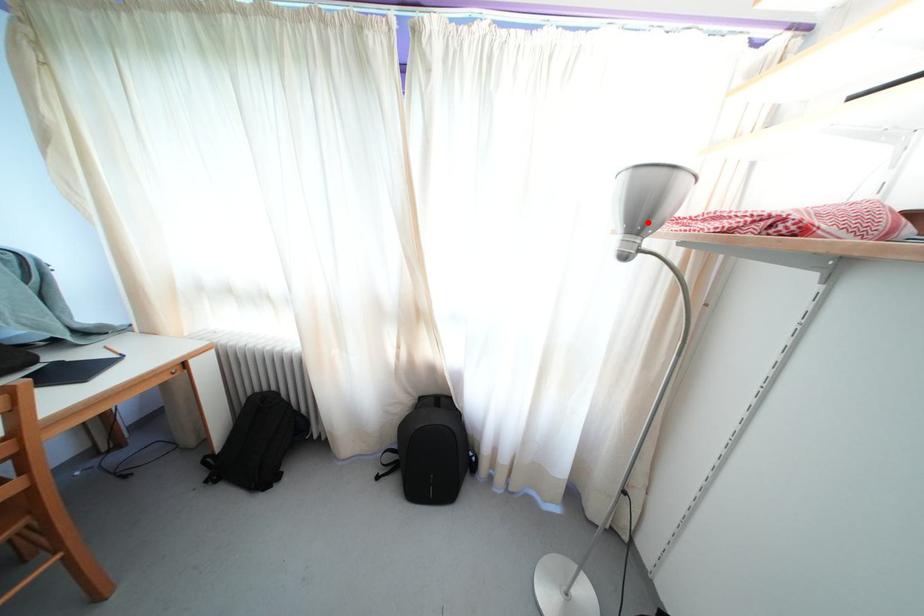
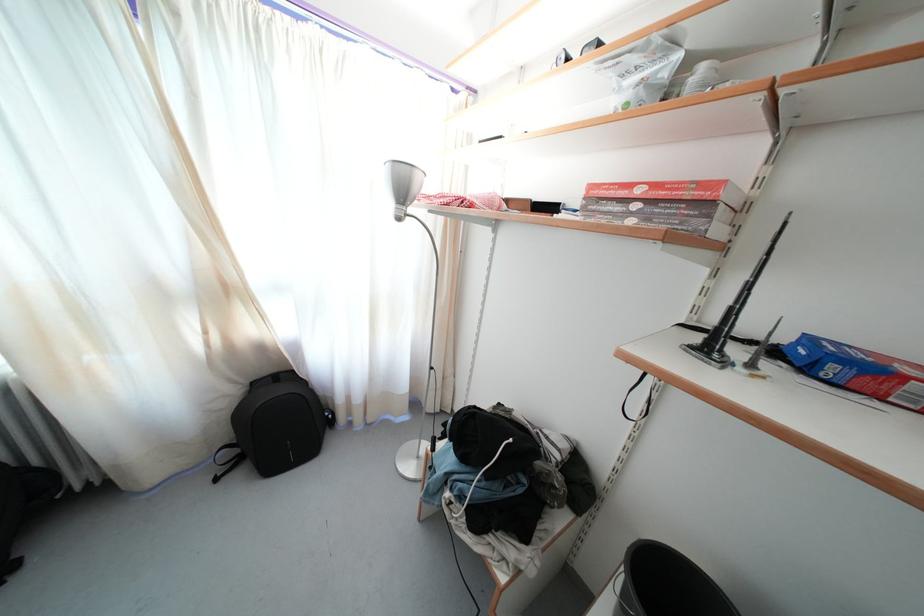
In the second image, find the point that corresponds to the highlighted location in the first image.

(408, 199)